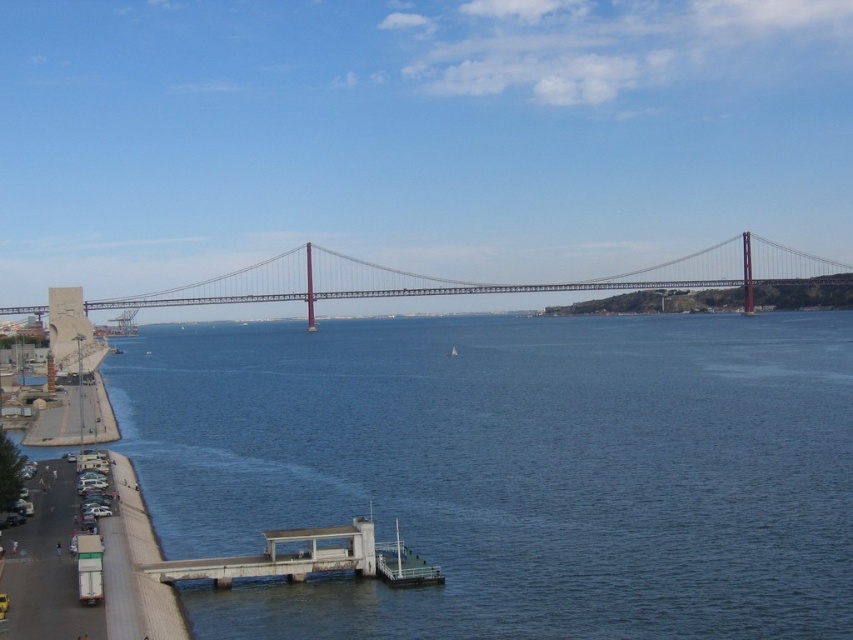
Looking at this image, you are a drone operator planning to fly a drone between the blue water at center and the metallic gray suspension bridge at center. The drone has a maximum flight distance of 50 meters. Can the drone safely fly between them without exceeding its range?

The distance between the blue water at center and the metallic gray suspension bridge at center is 52.47 meters, which exceeds the drone operator maximum flight range of 50 meters. Therefore, the drone cannot safely fly between them without exceeding its range.

You are a photographer planning to capture the blue water at center and the metallic gray suspension bridge at center in a single shot. Based on their positions, which object should appear lower in the photo?

The blue water at center is below the metallic gray suspension bridge at center, so the blue water at center will appear lower in the photo.

You are a photographer standing on the left side of the image, near the road with parked vehicles. You want to take a photo that includes both the blue water at center and the metallic gray suspension bridge at center. Based on their positions, which object should appear on the left side of your photo?

The metallic gray suspension bridge at center should appear on the left side of the photo because the blue water at center is positioned to the right of it.